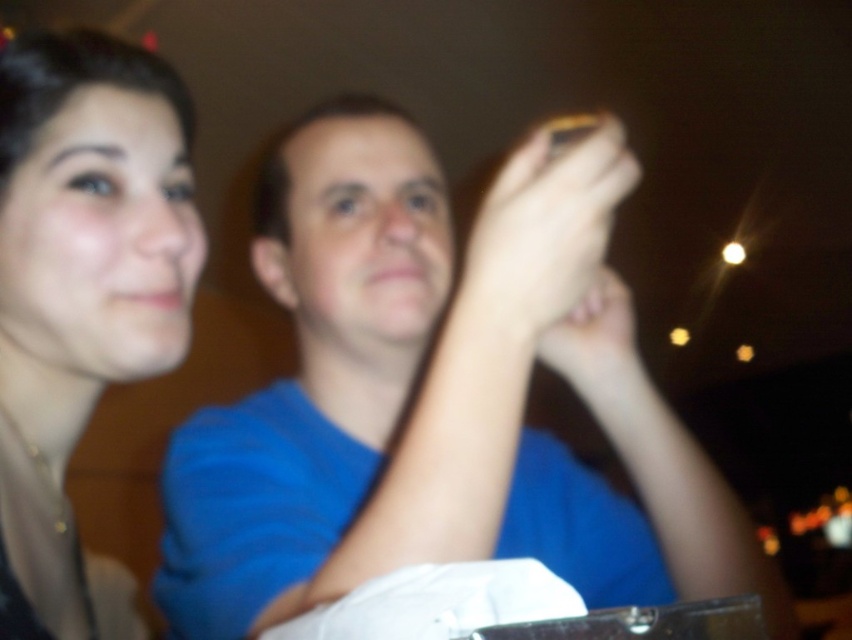
From the picture: You are a photographer trying to capture a clear photo of the smooth skin at upper center. However, the yellow matte phone at upper center is blocking your view. Can you move the phone to the side to get a clear shot?

The yellow matte phone at upper center is in front of smooth skin at upper center, so moving the phone to the side would allow you to capture a clear photo of the smooth skin at upper center.

You are a photographer adjusting a camera in a dimly lit room. You notice a yellow matte phone at upper center and smooth skin at upper center in your frame. Which object should you zoom in on to capture more details of the wider one?

You should zoom in on the yellow matte phone at upper center because its width surpasses that of the smooth skin at upper center, making it the wider object.

You are a photographer trying to focus on the subject in the image. The blue matte shirt at center and the smooth skin at upper center are both in the frame. Which object is taller?

The blue matte shirt at center has a greater height compared to smooth skin at upper center, so the blue matte shirt at center is taller.